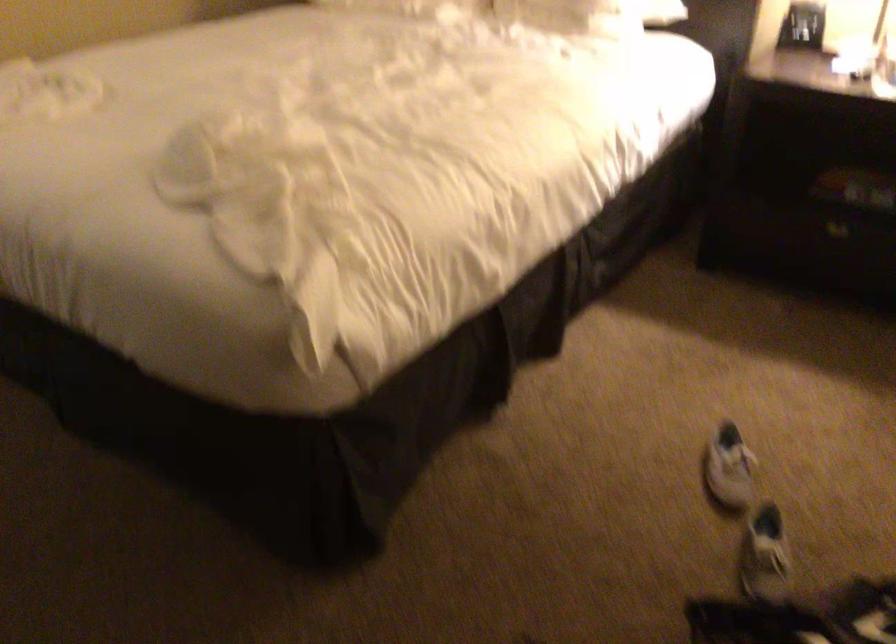
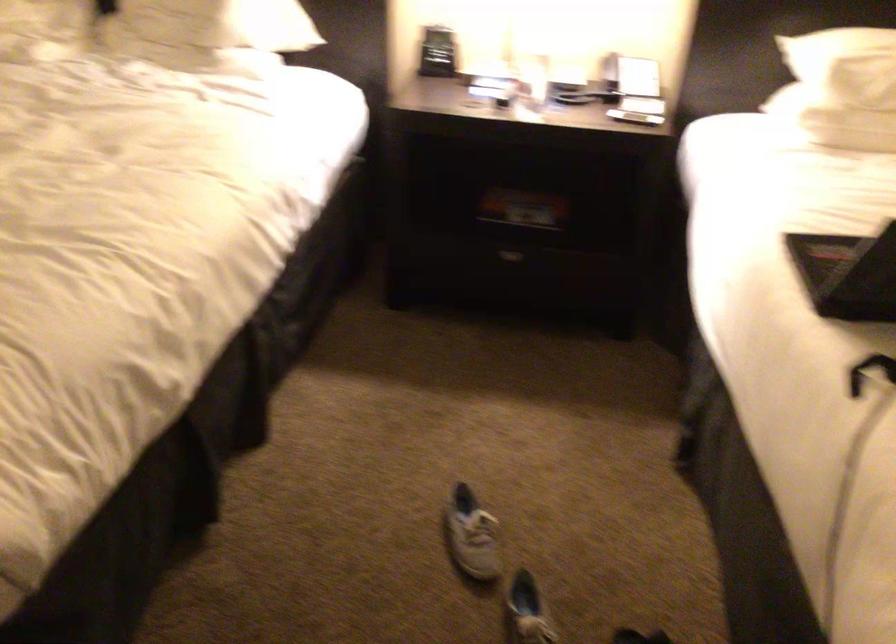
Question: What movement of the cameraman would produce the second image?

Choices:
 (A) Left
 (B) Right
 (C) Forward
 (D) Backward

Answer: (C)